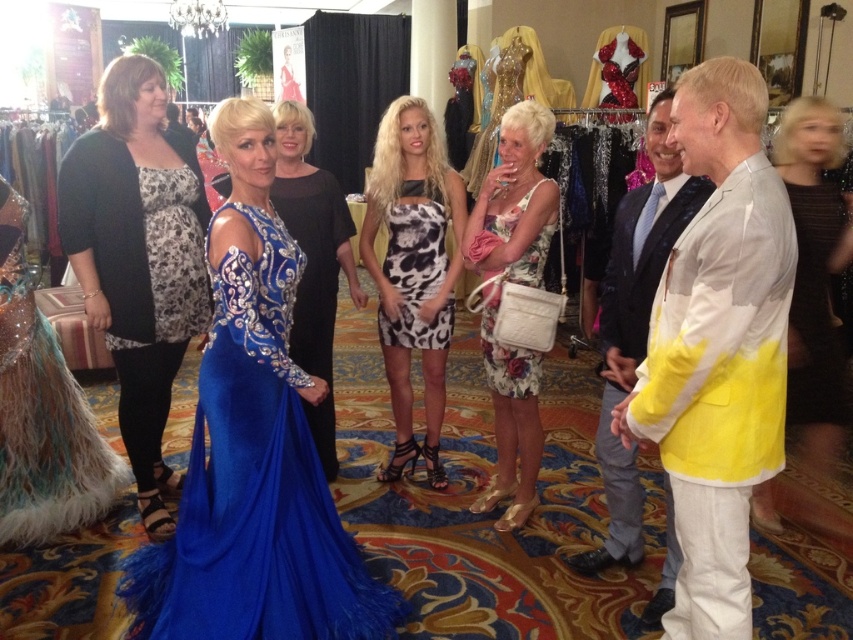
You are standing at the camera position and want to place a 1.5 meters long banner between you and the point at point (714, 330). Will the banner fit without overlapping the point?

The distance between the camera and point (714, 330) is 1.57 meters. Since the banner is 1.5 meters long, it will fit without overlapping the point, leaving a small gap of 0.07 meters.

You are a photographer at this event. You need to capture a photo that includes both the yellow and white fabric jacket at right and the printed fabric dress at center. Based on their positions, which one will appear lower in the photo?

The yellow and white fabric jacket at right appears lower in the photo because it is positioned below the printed fabric dress at center.